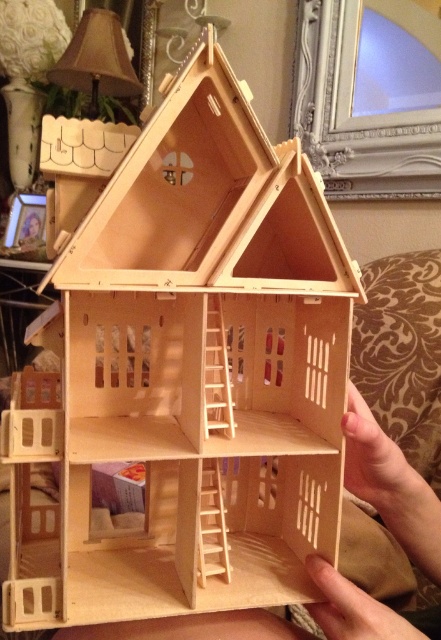
You are an interior designer planning to place the natural wood dollhouse at center and the beige fabric lampshade at upper left in a small room. Considering their sizes, which object should you place closer to the entrance to save space?

The natural wood dollhouse at center occupies less space than the beige fabric lampshade at upper left, so placing the natural wood dollhouse at center closer to the entrance would save more space.

You are an interior designer assessing the proportions of the natural wood dollhouse at center and the beige fabric lampshade at upper left. Which object is shorter in height?

The natural wood dollhouse at center has a lesser height compared to the beige fabric lampshade at upper left, so the natural wood dollhouse at center is shorter in height.

You are a tiny explorer standing at the point labeled point (x=135, y=77). You want to move towards the point labeled point (x=406, y=508). Since both points are on the dollhouse, which direction should you move to get closer to your destination?

You should move towards the point labeled point (x=406, y=508) because it is closer to the camera than point (x=135, y=77), so moving towards it would mean going in the direction of the camera.